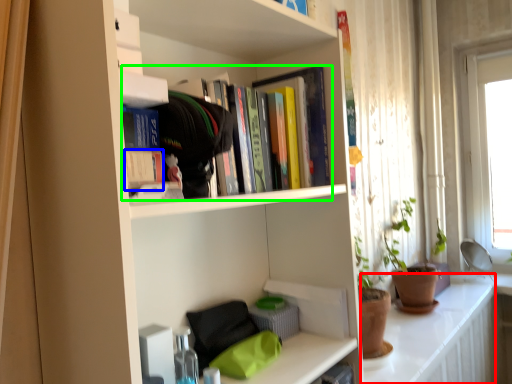
Question: Considering the real-world distances, which object is farthest from counter top (highlighted by a red box)? paperback book (highlighted by a blue box) or book (highlighted by a green box)?

Choices:
 (A) paperback book
 (B) book

Answer: (A)